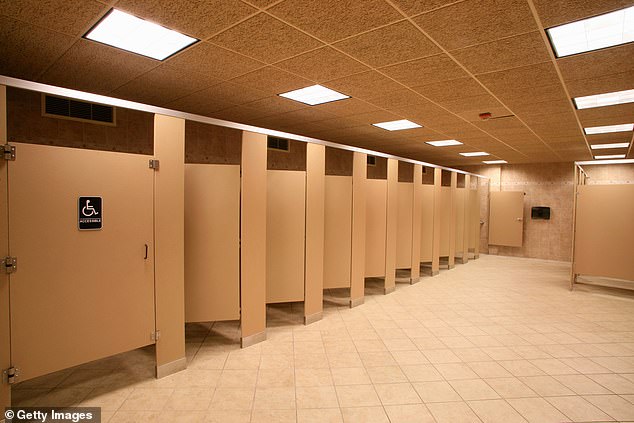
At what (x,y) coordinates should I click in order to perform the action: click on hand dryerr. Please return your answer as a coordinate pair (x, y). Looking at the image, I should click on (540, 212).